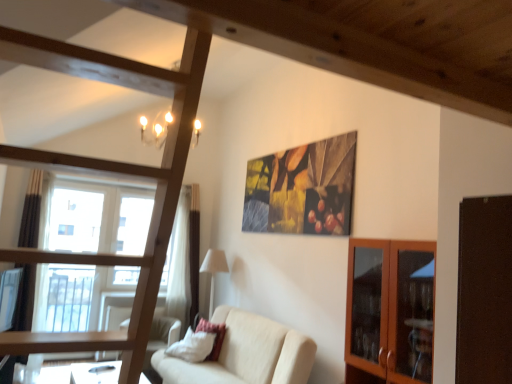
Question: Is beige fabric couch at center aimed at wooden frame bunk bed at center?

Choices:
 (A) yes
 (B) no

Answer: (B)

Question: Can you confirm if beige fabric couch at center is taller than wooden frame bunk bed at center?

Choices:
 (A) no
 (B) yes

Answer: (A)

Question: From a real-world perspective, is beige fabric couch at center below wooden frame bunk bed at center?

Choices:
 (A) no
 (B) yes

Answer: (B)

Question: Is beige fabric couch at center in contact with wooden frame bunk bed at center?

Choices:
 (A) no
 (B) yes

Answer: (A)

Question: From the image's perspective, would you say beige fabric couch at center is positioned over wooden frame bunk bed at center?

Choices:
 (A) yes
 (B) no

Answer: (B)

Question: In terms of width, does wooden frame bunk bed at center look wider or thinner when compared to wooden glass cabinet at right?

Choices:
 (A) wide
 (B) thin

Answer: (A)

Question: Is wooden frame bunk bed at center inside the boundaries of wooden glass cabinet at right, or outside?

Choices:
 (A) outside
 (B) inside

Answer: (A)

Question: In the image, is wooden frame bunk bed at center on the left side or the right side of wooden glass cabinet at right?

Choices:
 (A) right
 (B) left

Answer: (B)

Question: In terms of size, does wooden frame bunk bed at center appear bigger or smaller than wooden glass cabinet at right?

Choices:
 (A) big
 (B) small

Answer: (A)

Question: Is point (212, 259) positioned closer to the camera than point (263, 359)?

Choices:
 (A) farther
 (B) closer

Answer: (A)

Question: In terms of width, does white fabric lampshade at center look wider or thinner when compared to beige fabric couch at center?

Choices:
 (A) thin
 (B) wide

Answer: (A)

Question: From the image's perspective, is white fabric lampshade at center positioned above or below beige fabric couch at center?

Choices:
 (A) above
 (B) below

Answer: (A)

Question: In the image, is white fabric lampshade at center positioned in front of or behind beige fabric couch at center?

Choices:
 (A) behind
 (B) front

Answer: (A)

Question: Is beige fabric couch at center inside or outside of white fabric lampshade at center?

Choices:
 (A) outside
 (B) inside

Answer: (A)

Question: From the image's perspective, is beige fabric couch at center above or below white fabric lampshade at center?

Choices:
 (A) below
 (B) above

Answer: (A)